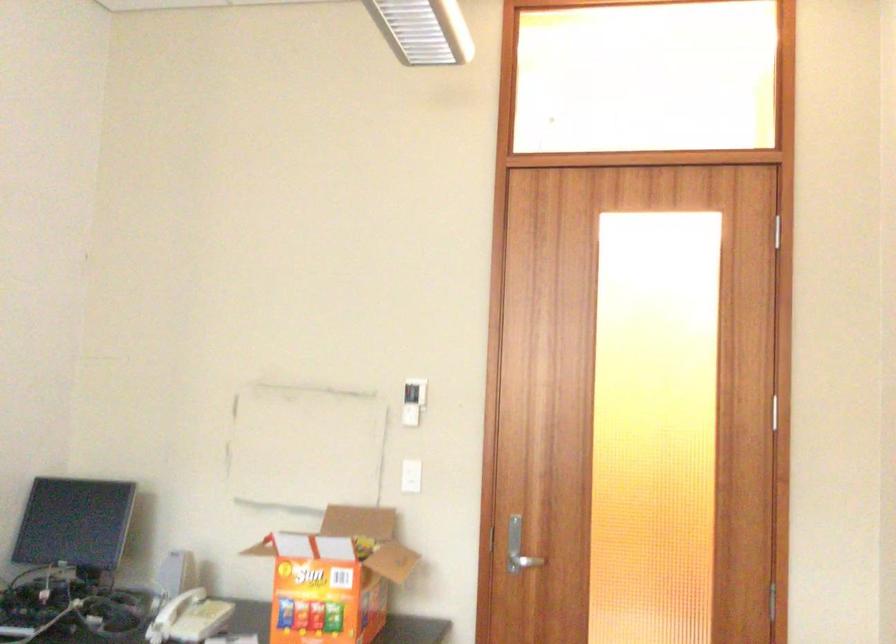
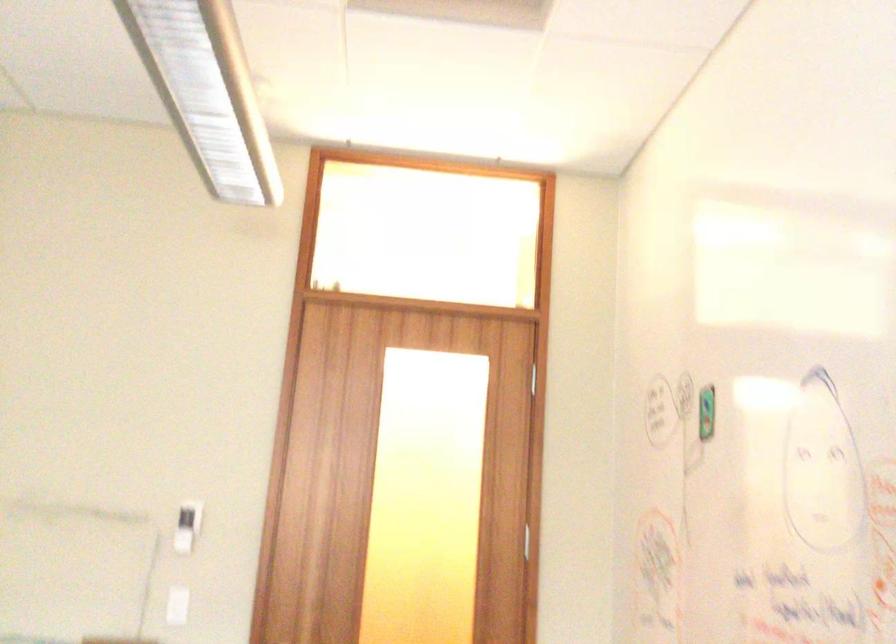
The images are taken continuously from a first-person perspective. In which direction are you moving?

The cameraman walked toward left, backward.